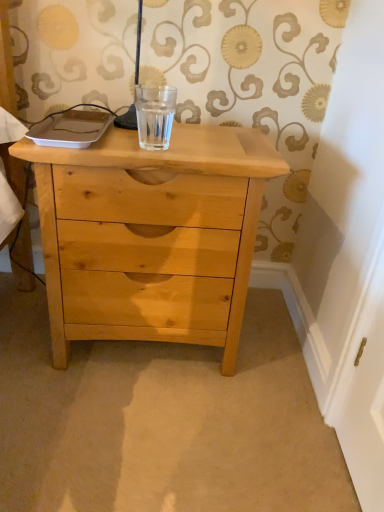
Where is `vacant area on top of natural wood chest of drawers at center (from a real-world perspective)`? vacant area on top of natural wood chest of drawers at center (from a real-world perspective) is located at coordinates (165, 131).